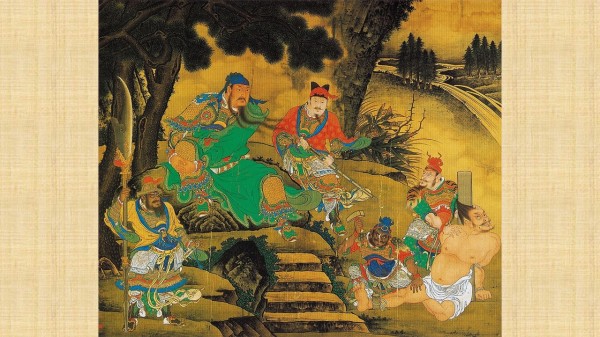
Where is `art piece`? The image size is (600, 337). art piece is located at coordinates (270, 250).